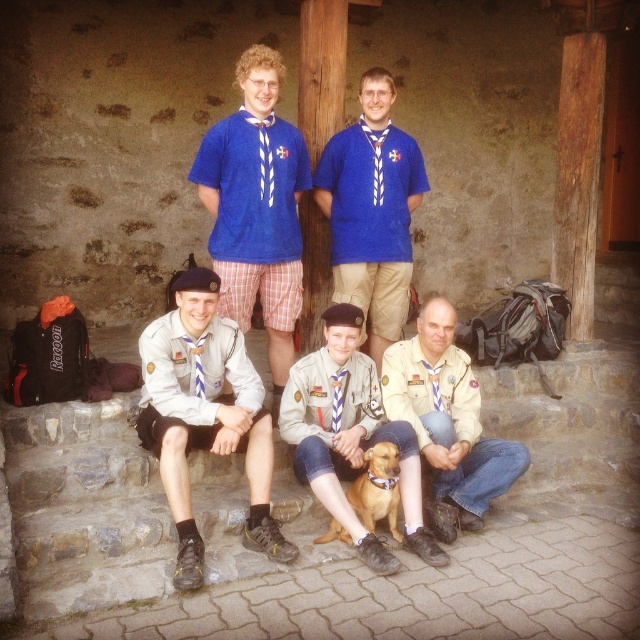
Question: Does blue knitted sweater at upper center come behind brown leather dog at center?

Choices:
 (A) no
 (B) yes

Answer: (B)

Question: Which object is the farthest from the light brown leather jacket at center?

Choices:
 (A) blue woven fabric shirt at upper center
 (B) light brown uniform at center
 (C) blue knitted sweater at upper center

Answer: (A)

Question: Which object appears closest to the camera in this image?

Choices:
 (A) blue knitted sweater at upper center
 (B) light brown uniform at lower left

Answer: (B)

Question: Is light brown uniform at lower left to the left of blue woven fabric shirt at upper center from the viewer's perspective?

Choices:
 (A) yes
 (B) no

Answer: (A)

Question: Can you confirm if blue knitted sweater at upper center is wider than light brown uniform at center?

Choices:
 (A) yes
 (B) no

Answer: (B)

Question: Estimate the real-world distances between objects in this image. Which object is farther from the brown leather dog at center?

Choices:
 (A) light brown uniform at center
 (B) light brown uniform at lower left
 (C) light brown leather jacket at center
 (D) blue knitted sweater at upper center

Answer: (D)